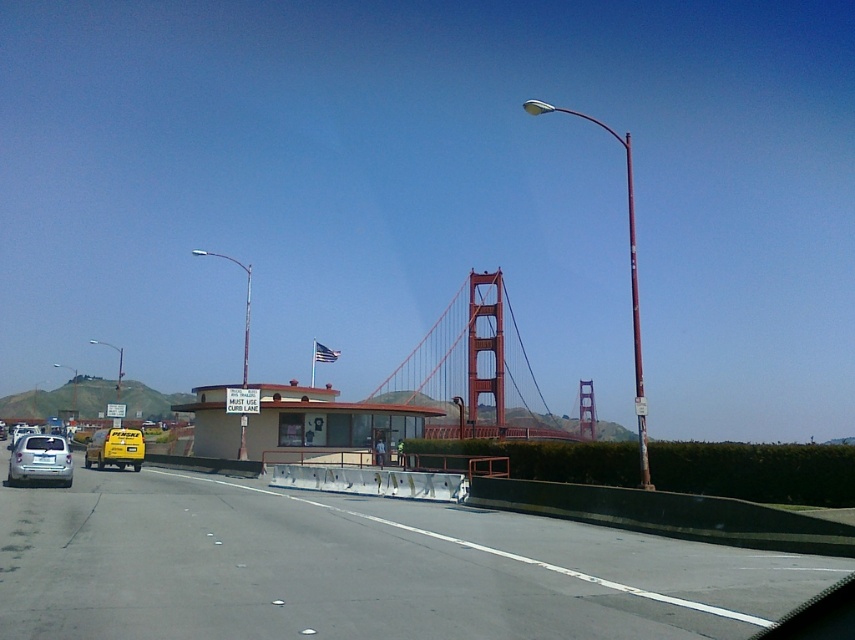
Who is more forward, (325,634) or (435,353)?

Point (325,634) is more forward.

Between gray asphalt highway at center and red painted steel bridge at center, which one appears on the left side from the viewer's perspective?

Positioned to the left is gray asphalt highway at center.

Is point (86, 499) positioned behind point (488, 349)?

No, it is in front of (488, 349).

Find the location of a particular element. gray asphalt highway at center is located at coordinates (358, 568).

From the picture: Is gray asphalt highway at center positioned before yellow matte taxi at left?

Yes.

Does point (788, 556) come in front of point (97, 458)?

Yes.

Find the location of a particular element. The width and height of the screenshot is (855, 640). gray asphalt highway at center is located at coordinates pos(358,568).

Does red painted steel bridge at center come in front of satin silver sedan at left?

No, red painted steel bridge at center is behind satin silver sedan at left.

How much distance is there between red painted steel bridge at center and satin silver sedan at left?

78.67 meters

This screenshot has width=855, height=640. What are the coordinates of `red painted steel bridge at center` in the screenshot? It's located at (476, 369).